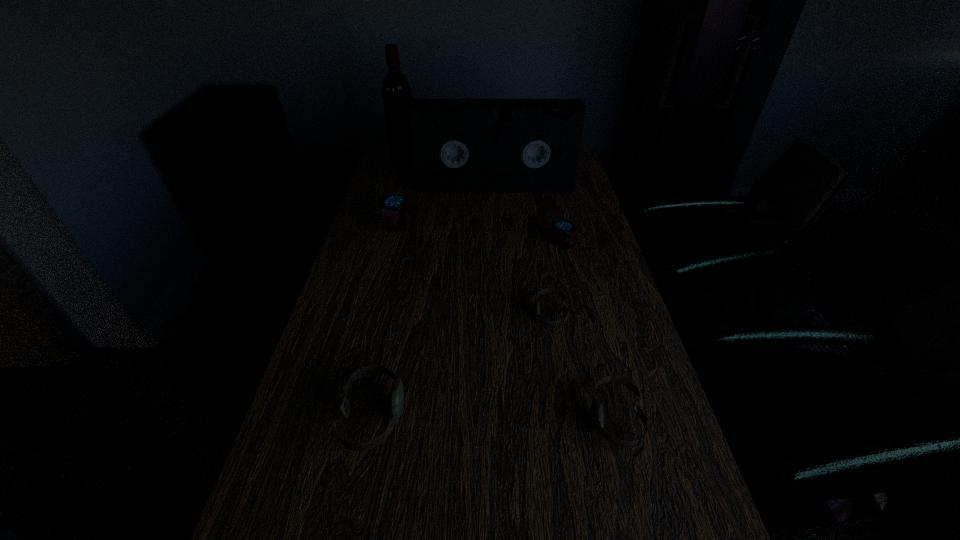
The image size is (960, 540). I want to click on the farthest object, so click(396, 91).

Locate an element on the screen. the tallest object is located at coordinates (396, 91).

This screenshot has height=540, width=960. In order to click on the sixth nearest object in this screenshot , I will do `click(458, 145)`.

The height and width of the screenshot is (540, 960). What are the coordinates of `the sixth shortest object` in the screenshot? It's located at (458, 145).

I want to click on the farther red watch, so click(x=394, y=208).

This screenshot has width=960, height=540. Identify the location of the left red watch. (394, 208).

Where is `the biggest beige watch`? Image resolution: width=960 pixels, height=540 pixels. the biggest beige watch is located at coordinates (398, 391).

Find the location of a particular element. Image resolution: width=960 pixels, height=540 pixels. the fourth nearest watch is located at coordinates (564, 228).

You are a GUI agent. You are given a task and a screenshot of the screen. Output one action in this format:
    pyautogui.click(x=<x>, y=<y>)
    Task: Click on the fourth farthest object
    Image resolution: width=960 pixels, height=540 pixels.
    Given the screenshot: What is the action you would take?
    pyautogui.click(x=564, y=228)

In order to click on the rightmost beige watch in this screenshot , I will do `click(596, 406)`.